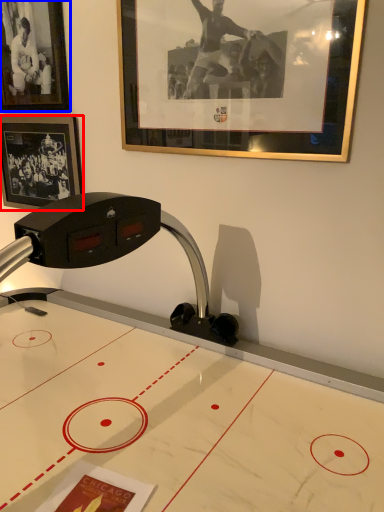
Question: Among these objects, which one is farthest to the camera, picture frame (highlighted by a red box) or picture frame (highlighted by a blue box)?

Choices:
 (A) picture frame
 (B) picture frame

Answer: (A)